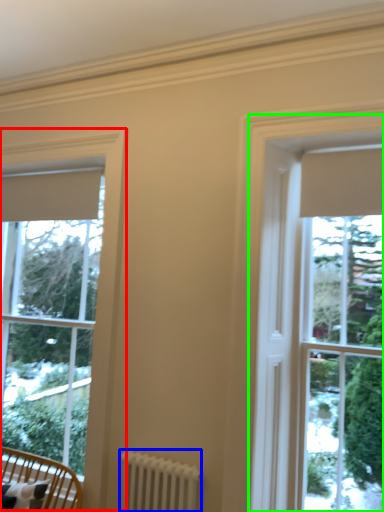
Question: Estimate the real-world distances between objects in this image. Which object is farther from window (highlighted by a red box), radiator (highlighted by a blue box) or bay window (highlighted by a green box)?

Choices:
 (A) radiator
 (B) bay window

Answer: (B)